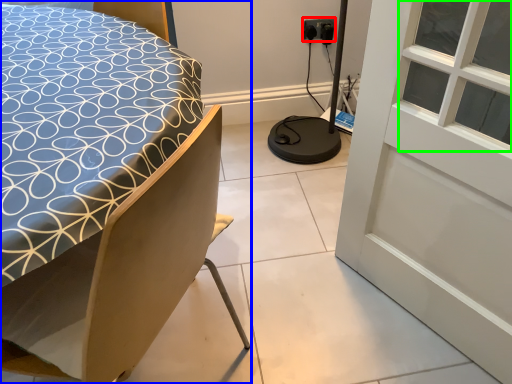
Question: Considering the real-world distances, which object is farthest from electric outlet (highlighted by a red box)? bed (highlighted by a blue box) or window (highlighted by a green box)?

Choices:
 (A) bed
 (B) window

Answer: (A)